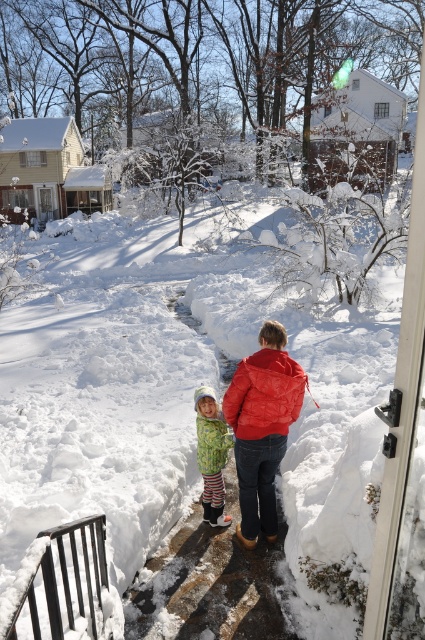
You are a photographer trying to capture both the matte red puffer jacket at center and the fluffy green snowsuit at lower center in the same frame. Based on their positions, which one should you adjust your camera to focus on first to ensure both are in the shot?

The matte red puffer jacket at center is to the right of the fluffy green snowsuit at lower center, so you should focus on the fluffy green snowsuit at lower center first to ensure both are captured in the frame.

You are a photographer trying to capture both the matte red puffer jacket at center and the fluffy green snowsuit at lower center in the same frame. Which of the two subjects should you focus on first to ensure both are in focus?

The fluffy green snowsuit at lower center is taller than the matte red puffer jacket at center, so focusing on the taller subject first will help ensure both are in focus.

You are designing a new clothing line and want to ensure jackets fit different body types. If you have two jackets, the red quilted jacket at center and the green textured jacket at lower center, which one would you recommend for a customer who prefers a looser, more relaxed fit?

The red quilted jacket at center has a larger width than the green textured jacket at lower center, so it would be more suitable for a customer seeking a looser, relaxed fit.